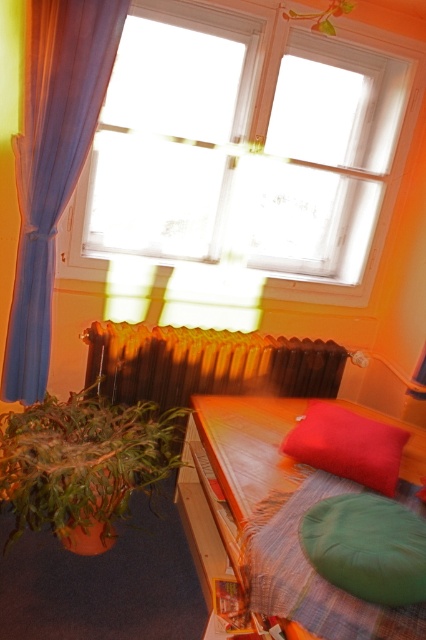
You are standing in the room and want to reach a specific point marked at coordinates point [68,52]. If your current position is 3.2 feet away from that point, how much further do you need to move forward to reach it?

You need to move forward 5.80 feet minus your current 3.2 feet distance, so 2.6 feet further to reach point [68,52].